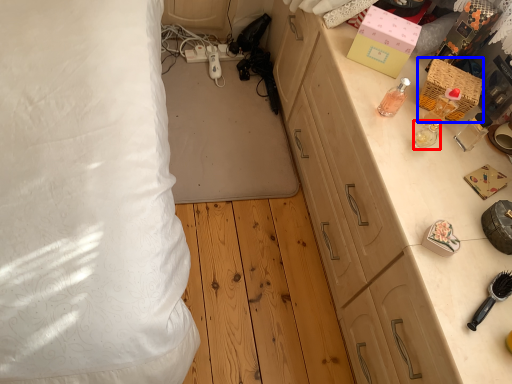
Question: Which object is further to the camera taking this photo, perfume (highlighted by a red box) or box (highlighted by a blue box)?

Choices:
 (A) perfume
 (B) box

Answer: (B)